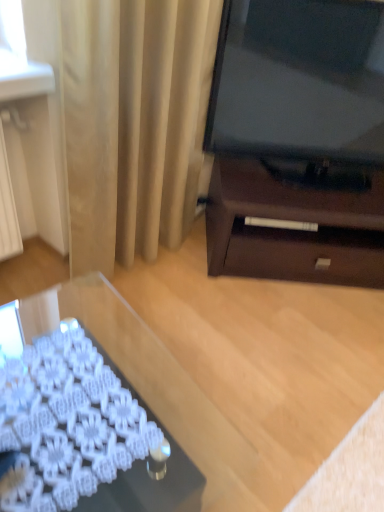
Find the location of a particular element. vacant space in beige fabric curtain at upper left (from a real-world perspective) is located at coordinates (144, 260).